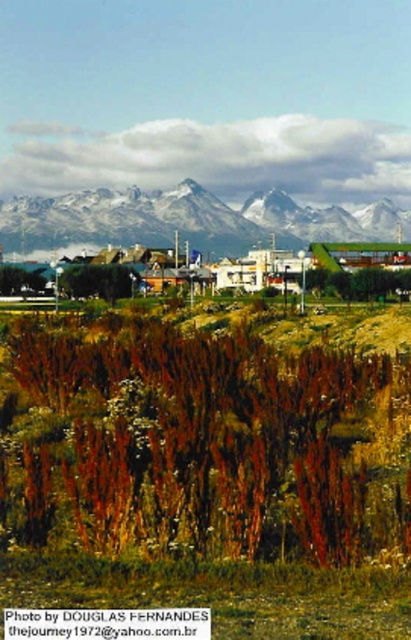
You are standing at the point marked by the coordinates point (200,442) in the image. What is the terrain like at that location?

The terrain at point (200,442) is brown grass at lower center.

You are standing in the landscape and want to take a photo of the brown grass at lower center and the snowy granite mountain range at upper center. Which object will appear larger in the photo?

The snowy granite mountain range at upper center will appear larger in the photo because it is taller than the brown grass at lower center.

You are standing in the landscape scene and want to determine which of the two points, point (x=228, y=333) or point (x=164, y=209), is nearer to you. Based on the scene description, which point would you say is closer?

Point (x=228, y=333) is closer to the camera than point (x=164, y=209), so it is the nearer point.